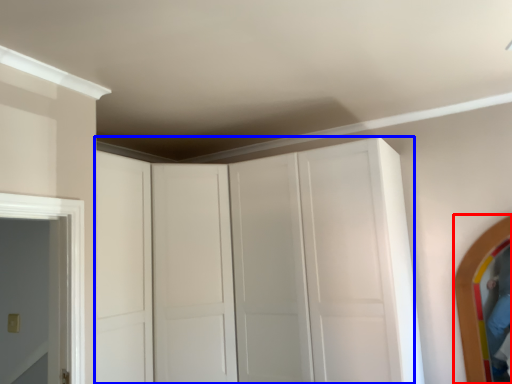
Question: Among these objects, which one is nearest to the camera, mirror (highlighted by a red box) or dresser (highlighted by a blue box)?

Choices:
 (A) mirror
 (B) dresser

Answer: (B)